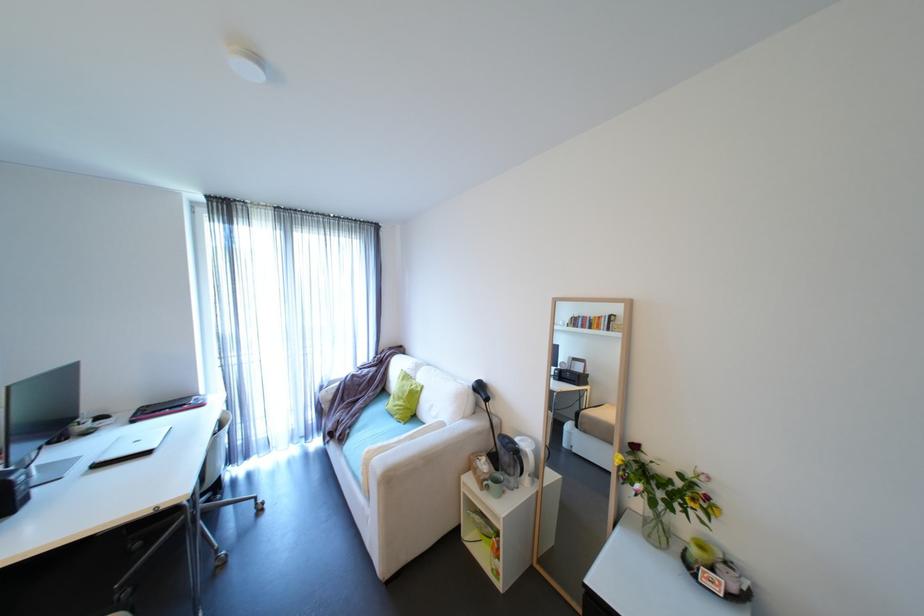
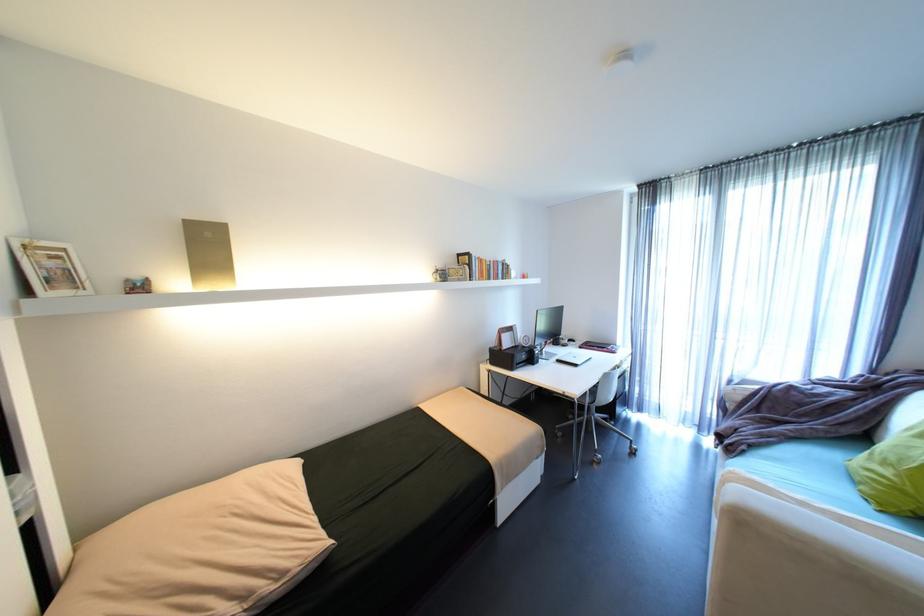
Locate, in the second image, the point that corresponds to pixel 411 402 in the first image.

(906, 476)